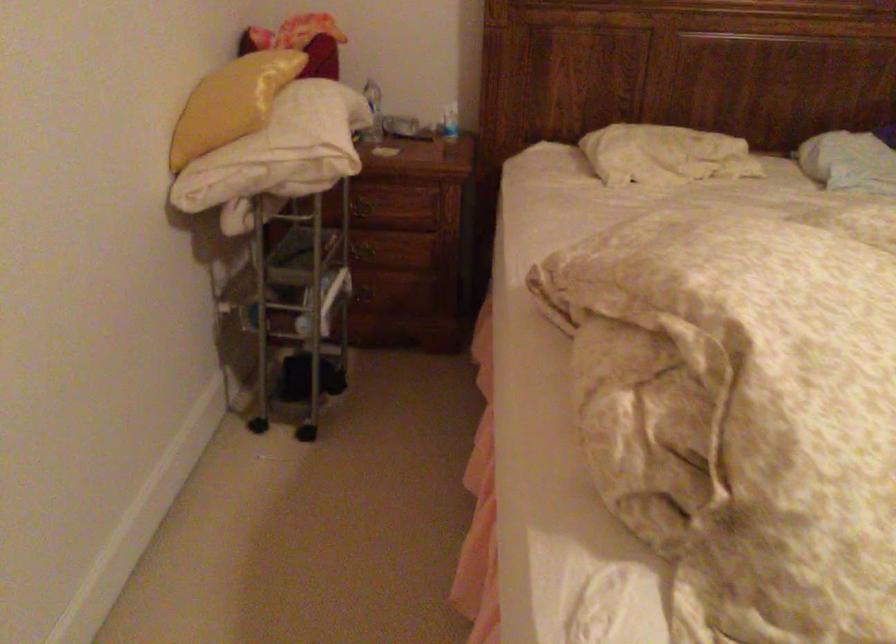
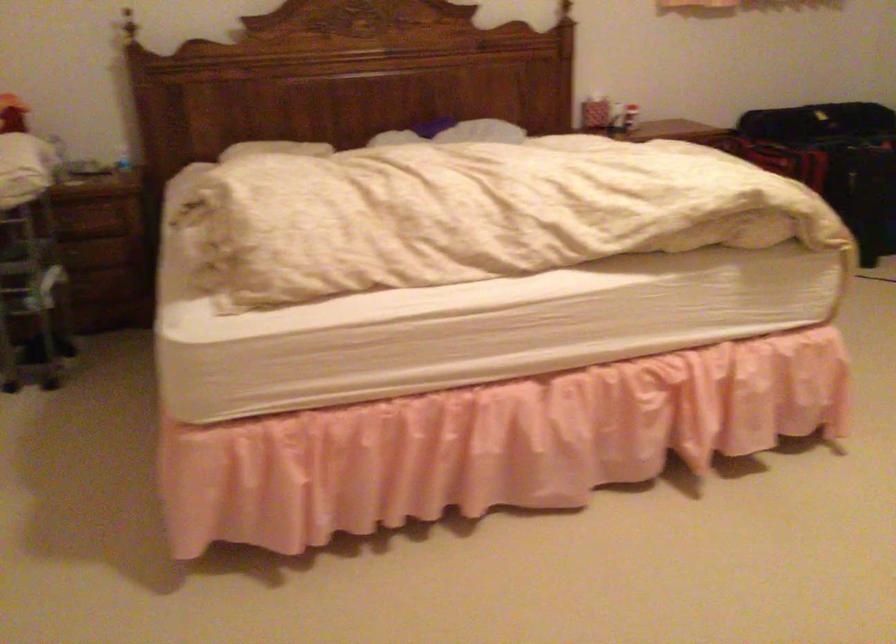
Question: The images are taken continuously from a first-person perspective. In which direction are you moving?

Choices:
 (A) Left
 (B) Right
 (C) Forward
 (D) Backward

Answer: (D)